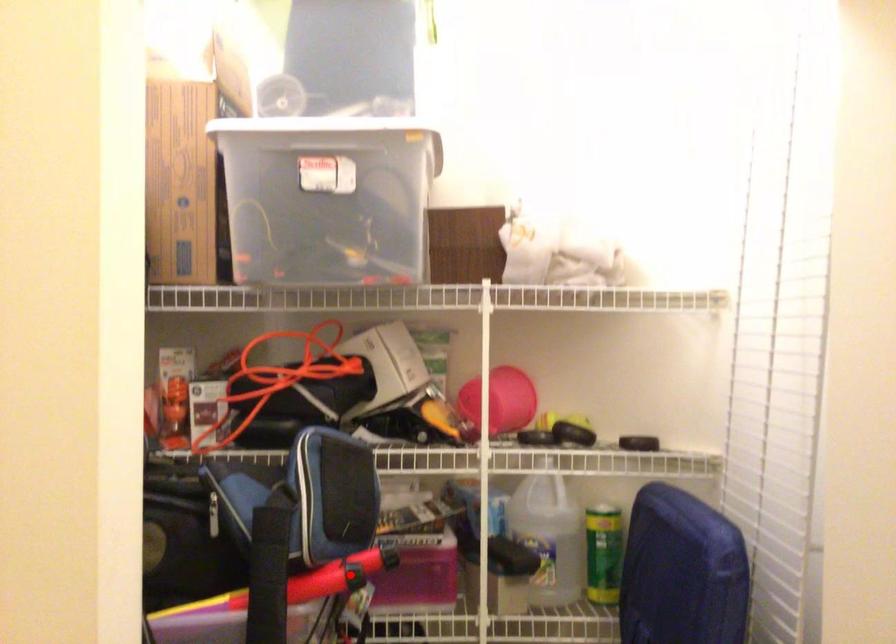
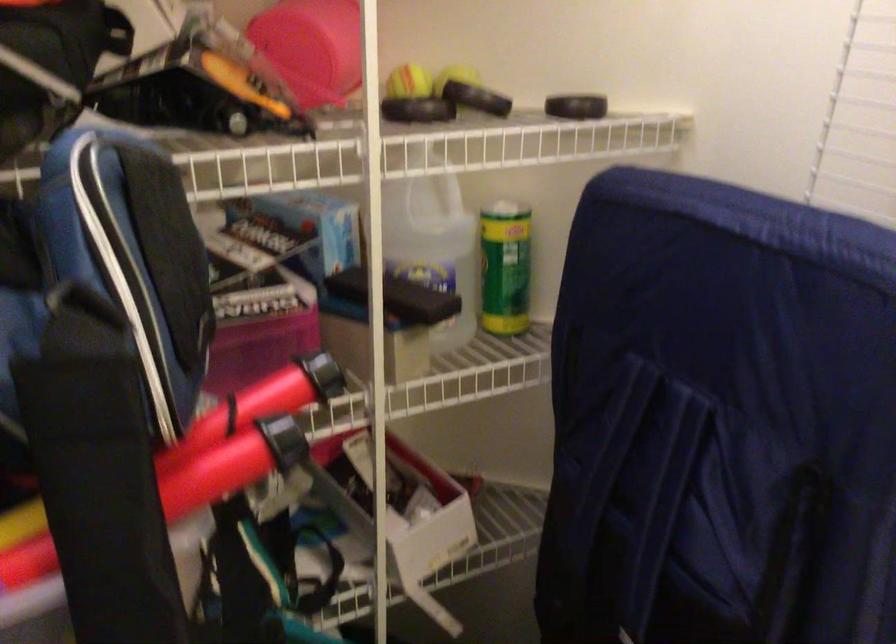
Question: I am providing you with two images of the same scene from different viewpoints. Given a red point in image1, look at the same physical point in image2. Is it:

Choices:
 (A) Closer to the viewpoint
 (B) Farther from the viewpoint

Answer: (A)